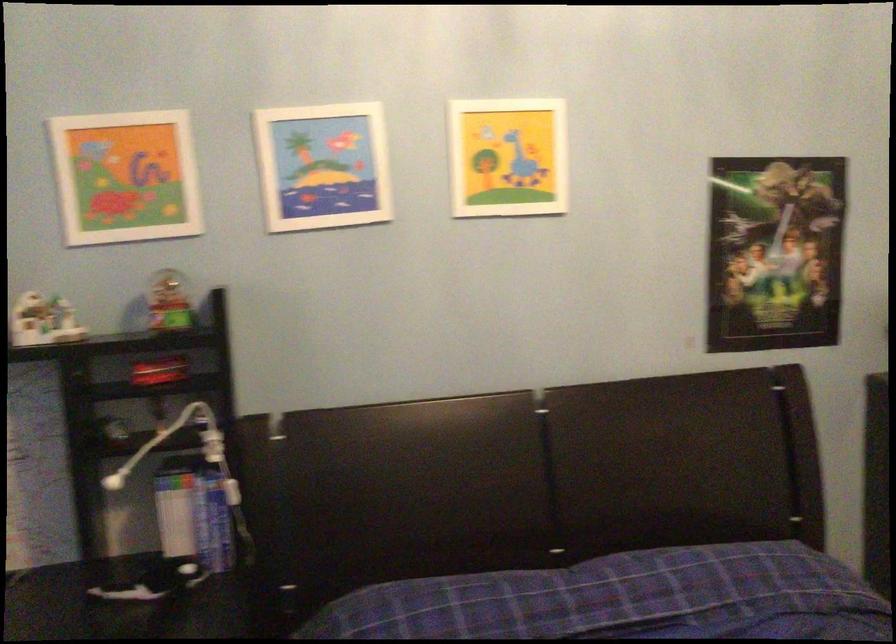
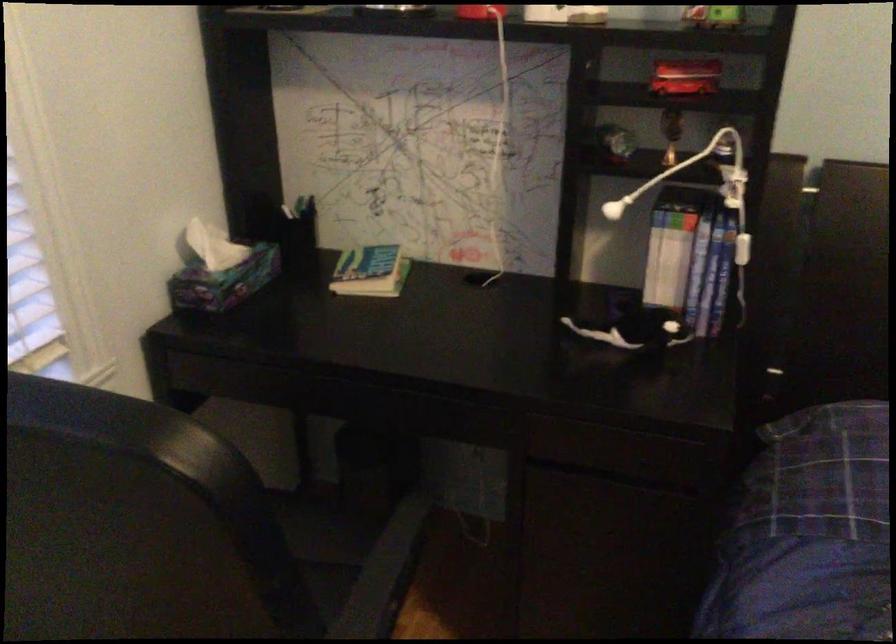
Where in the second image is the point corresponding to (217,529) from the first image?

(707, 288)